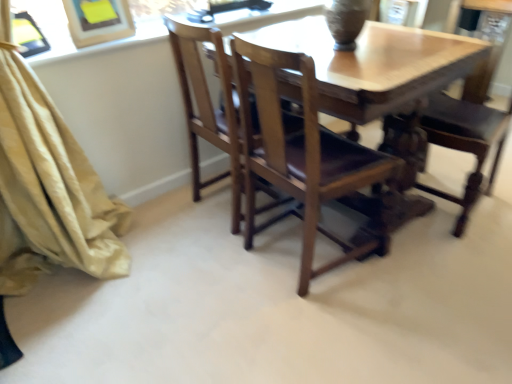
Question: Could you tell me if matte brown vase at upper center is facing wooden chair at center, the 1th chair from the left?

Choices:
 (A) yes
 (B) no

Answer: (B)

Question: Considering the relative sizes of matte brown vase at upper center and wooden chair at center, the 1th chair from the left, in the image provided, is matte brown vase at upper center taller than wooden chair at center, the 1th chair from the left,?

Choices:
 (A) no
 (B) yes

Answer: (A)

Question: Is wooden chair at center, the 1th chair from the left, at the back of matte brown vase at upper center?

Choices:
 (A) no
 (B) yes

Answer: (A)

Question: Is matte brown vase at upper center smaller than wooden chair at center, acting as the 2th chair starting from the right?

Choices:
 (A) yes
 (B) no

Answer: (A)

Question: Is matte brown vase at upper center to the left of wooden chair at center, the 1th chair from the left, from the viewer's perspective?

Choices:
 (A) no
 (B) yes

Answer: (A)

Question: Is matte brown vase at upper center completely or partially outside of wooden chair at center, acting as the 2th chair starting from the right?

Choices:
 (A) no
 (B) yes

Answer: (B)

Question: Can you confirm if wooden chair at center, the 1th chair from the right, is thinner than wooden chair at center, acting as the 2th chair starting from the right?

Choices:
 (A) yes
 (B) no

Answer: (B)

Question: Does wooden chair at center, which is the second chair in left-to-right order, turn towards wooden chair at center, acting as the 2th chair starting from the right?

Choices:
 (A) yes
 (B) no

Answer: (A)

Question: Is wooden chair at center, acting as the 2th chair starting from the right, located within wooden chair at center, the 1th chair from the right?

Choices:
 (A) no
 (B) yes

Answer: (A)

Question: Are wooden chair at center, the 1th chair from the right, and wooden chair at center, the 1th chair from the left, far apart?

Choices:
 (A) yes
 (B) no

Answer: (B)

Question: Does wooden chair at center, the 1th chair from the right, have a larger size compared to wooden chair at center, acting as the 2th chair starting from the right?

Choices:
 (A) no
 (B) yes

Answer: (B)

Question: Are wooden chair at center, which is the second chair in left-to-right order, and wooden chair at center, acting as the 2th chair starting from the right, making contact?

Choices:
 (A) no
 (B) yes

Answer: (A)

Question: From a real-world perspective, is beige fabric curtain at left on top of matte brown vase at upper center?

Choices:
 (A) yes
 (B) no

Answer: (B)